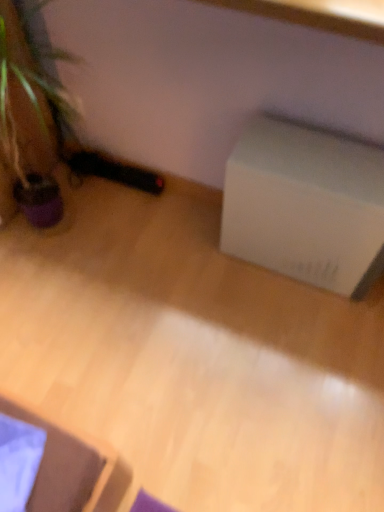
Where is `vacant point above white matte box at lower right (from a real-world perspective)`? The height and width of the screenshot is (512, 384). vacant point above white matte box at lower right (from a real-world perspective) is located at coordinates (320, 156).